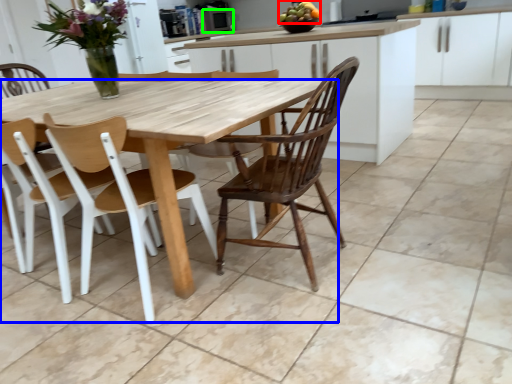
Question: Which object is the farthest from fruit (highlighted by a red box)? Choose among these: table (highlighted by a blue box) or appliance (highlighted by a green box).

Choices:
 (A) table
 (B) appliance

Answer: (A)